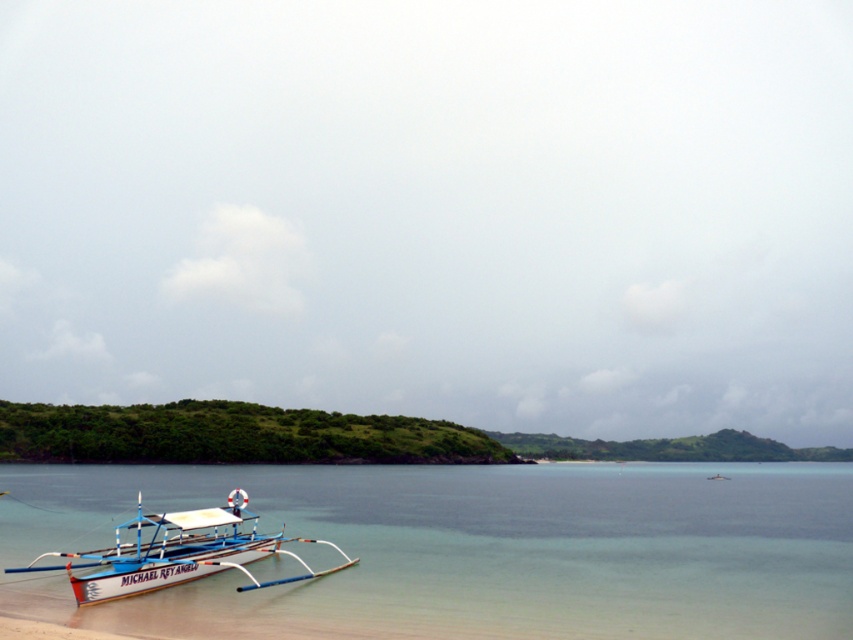
You are standing on the beach and see the clear blue water at lower left and the white matte boat at lower left. Which one is positioned lower in the scene?

The clear blue water at lower left is positioned lower than the white matte boat at lower left because it is located below it.

You are standing on the beach and want to take a photo of the clear blue water at lower left and the white matte boat at lower left. Which object will appear closer to the camera in the photo?

The clear blue water at lower left will appear closer to the camera in the photo because it is in front of the white matte boat at lower left.